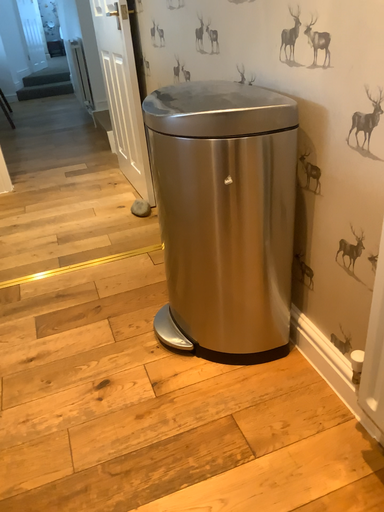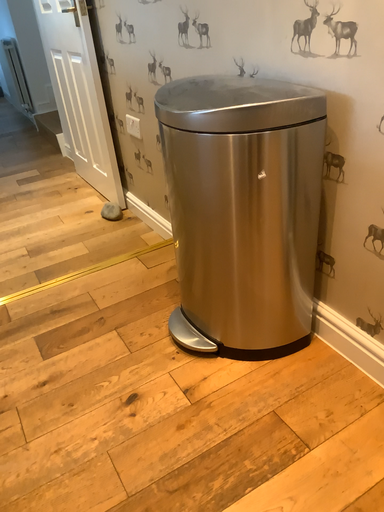
Question: Which way did the camera rotate in the video?

Choices:
 (A) rotated left
 (B) rotated right

Answer: (B)